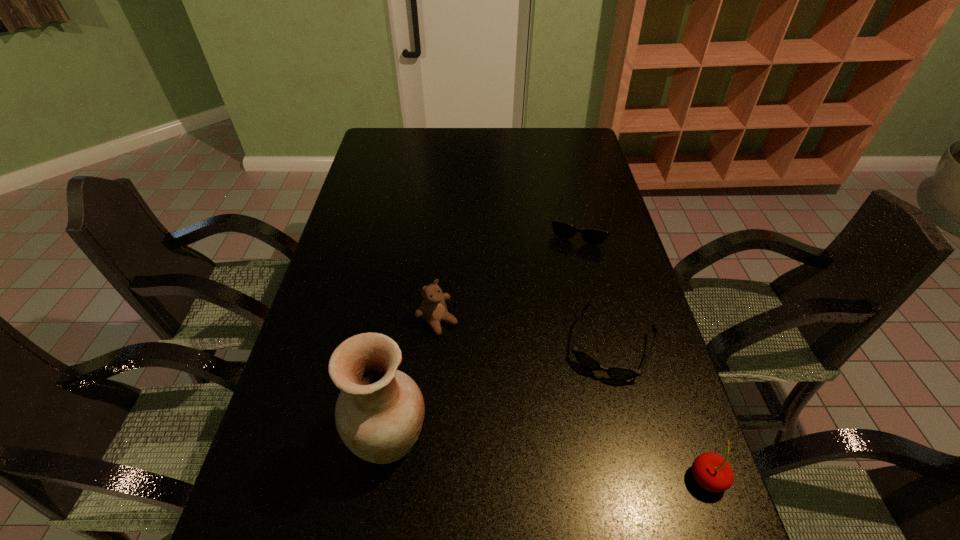
Locate an element on the screen. The width and height of the screenshot is (960, 540). the tallest object is located at coordinates (379, 413).

The image size is (960, 540). What are the coordinates of `cherry` in the screenshot? It's located at click(x=711, y=471).

I want to click on the farthest object, so click(564, 230).

Find the location of a particular element. This screenshot has width=960, height=540. teddy bear is located at coordinates (433, 309).

You are a GUI agent. You are given a task and a screenshot of the screen. Output one action in this format:
    pyautogui.click(x=<x>, y=<y>)
    Task: Click on the nearer sunglasses
    This screenshot has height=540, width=960.
    Given the screenshot: What is the action you would take?
    point(619,373)

Image resolution: width=960 pixels, height=540 pixels. Identify the location of vacant space situated 0.080m on the left of the tallest object. (313, 437).

You are a GUI agent. You are given a task and a screenshot of the screen. Output one action in this format:
    pyautogui.click(x=<x>, y=<y>)
    Task: Click on the vacant position located on the left of the cherry
    The height and width of the screenshot is (540, 960).
    Given the screenshot: What is the action you would take?
    pyautogui.click(x=588, y=478)

Find the location of a particular element. vacant area located 0.150m at the front lenses of the farthest object is located at coordinates (566, 279).

Where is `vacant space positioned 0.070m at the front lenses of the farthest object`? The image size is (960, 540). vacant space positioned 0.070m at the front lenses of the farthest object is located at coordinates (572, 261).

Where is `vacant position located at the front lenses of the farthest object`? vacant position located at the front lenses of the farthest object is located at coordinates (x=562, y=293).